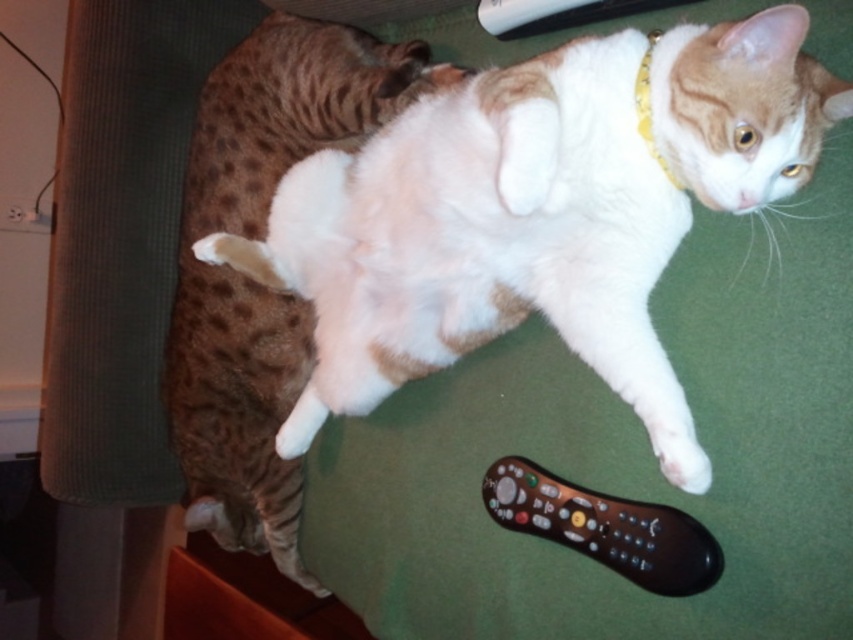
Does white fur cat at center have a greater width compared to black plastic remote at lower right?

Correct, the width of white fur cat at center exceeds that of black plastic remote at lower right.

Can you confirm if white fur cat at center is shorter than black plastic remote at lower right?

No, white fur cat at center is not shorter than black plastic remote at lower right.

Is point (599, 260) closer to camera compared to point (627, 529)?

No, it is behind (627, 529).

The width and height of the screenshot is (853, 640). Find the location of `white fur cat at center`. white fur cat at center is located at coordinates (485, 241).

Who is higher up, white fur cat at center or gold/yellow fabric neckband at upper right?

gold/yellow fabric neckband at upper right is above.

Is white fur cat at center above gold/yellow fabric neckband at upper right?

No, white fur cat at center is not above gold/yellow fabric neckband at upper right.

What do you see at coordinates (485, 241) in the screenshot?
I see `white fur cat at center` at bounding box center [485, 241].

This screenshot has height=640, width=853. In order to click on white fur cat at center in this screenshot , I will do `click(485, 241)`.

Does black plastic remote at lower right appear on the left side of gold/yellow fabric neckband at upper right?

Indeed, black plastic remote at lower right is positioned on the left side of gold/yellow fabric neckband at upper right.

Does black plastic remote at lower right have a larger size compared to gold/yellow fabric neckband at upper right?

Indeed, black plastic remote at lower right has a larger size compared to gold/yellow fabric neckband at upper right.

What do you see at coordinates (604, 528) in the screenshot? This screenshot has height=640, width=853. I see `black plastic remote at lower right` at bounding box center [604, 528].

Identify the location of black plastic remote at lower right. This screenshot has height=640, width=853. (604, 528).